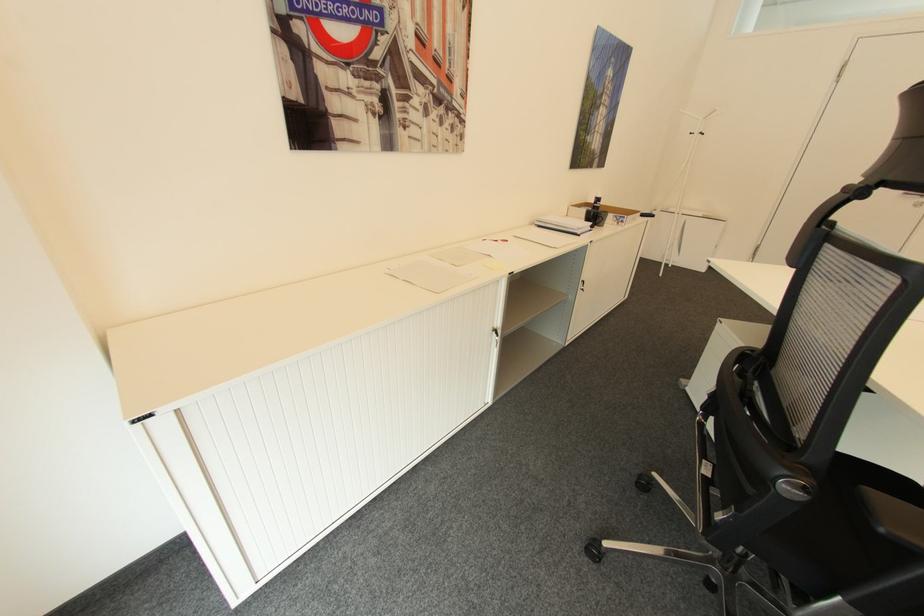
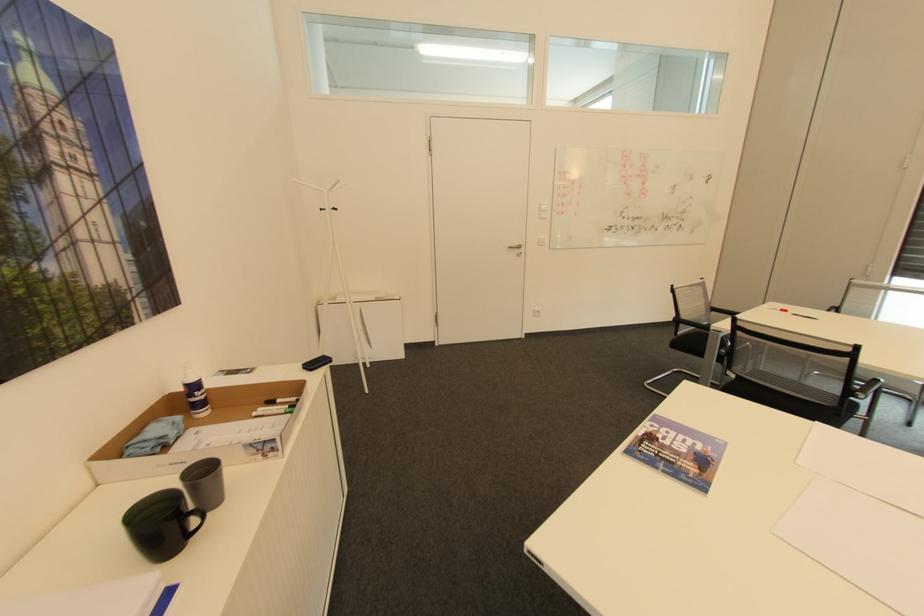
Where in the second image is the point corresponding to (603,197) from the first image?

(197, 379)